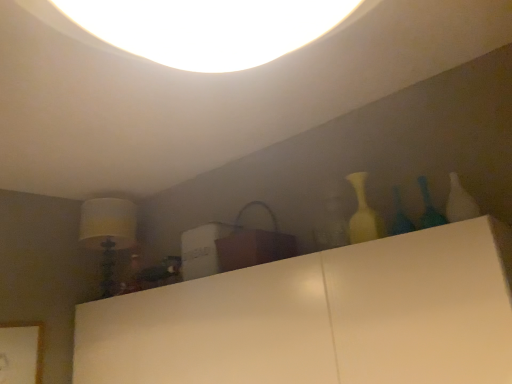
Question: Visually, is white fabric lampshade at left positioned to the left or to the right of translucent glass vase at upper right, which is the first glass vase in left-to-right order?

Choices:
 (A) left
 (B) right

Answer: (A)

Question: Considering the positions of point (94, 221) and point (401, 215), is point (94, 221) closer or farther from the camera than point (401, 215)?

Choices:
 (A) closer
 (B) farther

Answer: (B)

Question: Estimate the real-world distances between objects in this image. Which object is closer to the translucent glass vase at right, placed as the 2th glass vase when sorted from left to right?

Choices:
 (A) white fabric lampshade at left
 (B) translucent glass vase at upper right, which is the first glass vase in left-to-right order
 (C) matte white vase at right

Answer: (B)

Question: Which object is positioned farthest from the translucent glass vase at right, placed as the 2th glass vase when sorted from left to right?

Choices:
 (A) white fabric lampshade at left
 (B) translucent glass vase at upper right, which is the first glass vase in left-to-right order
 (C) matte white vase at right

Answer: (A)